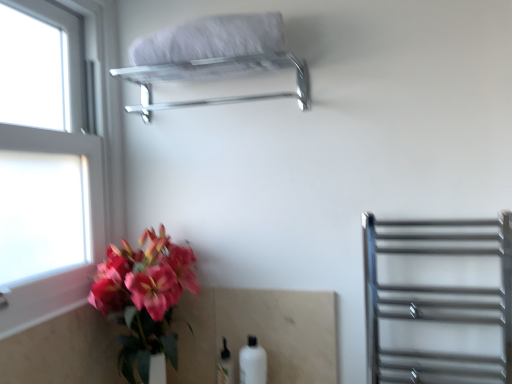
What are the coordinates of `polished chrome towel rack at right` in the screenshot? It's located at (438, 300).

The image size is (512, 384). What do you see at coordinates (438, 300) in the screenshot? I see `polished chrome towel rack at right` at bounding box center [438, 300].

The height and width of the screenshot is (384, 512). What are the coordinates of `white matte bottle at lower center, the second bottle from the left` in the screenshot? It's located at (252, 363).

Describe the element at coordinates (252, 363) in the screenshot. I see `white matte bottle at lower center, which appears as the 1th bottle when viewed from the right` at that location.

Find the location of a particular element. The image size is (512, 384). polished chrome towel rack at upper center is located at coordinates (212, 58).

Where is `white matte bottle at lower center, the 2th bottle positioned from the right`? The image size is (512, 384). white matte bottle at lower center, the 2th bottle positioned from the right is located at coordinates (225, 366).

Between polished chrome towel rack at right and polished chrome towel rack at upper center, which one has smaller width?

polished chrome towel rack at upper center.

Considering their positions, is polished chrome towel rack at right located in front of or behind polished chrome towel rack at upper center?

Visually, polished chrome towel rack at right is located in front of polished chrome towel rack at upper center.

Is polished chrome towel rack at right positioned far away from polished chrome towel rack at upper center?

No, polished chrome towel rack at right is not far from polished chrome towel rack at upper center.

Is white glass window at left located within white fluffy towel at upper center?

No.

From the picture: Can you confirm if white fluffy towel at upper center is smaller than white glass window at left?

Correct, white fluffy towel at upper center occupies less space than white glass window at left.

What's the angular difference between white fluffy towel at upper center and white glass window at left's facing directions?

90.1 degrees separate the facing orientations of white fluffy towel at upper center and white glass window at left.

Is white fluffy towel at upper center next to white glass window at left and touching it?

There is a gap between white fluffy towel at upper center and white glass window at left.

Is white matte bottle at lower center, which ranks as the first bottle in left-to-right order, wider than white fluffy towel at upper center?

No.

From the image's perspective, relative to white fluffy towel at upper center, is white matte bottle at lower center, the 2th bottle positioned from the right, above or below?

white matte bottle at lower center, the 2th bottle positioned from the right, is situated lower than white fluffy towel at upper center in the image.

Is white matte bottle at lower center, which ranks as the first bottle in left-to-right order, surrounding white fluffy towel at upper center?

No, white fluffy towel at upper center is located outside of white matte bottle at lower center, which ranks as the first bottle in left-to-right order.

Are white matte bottle at lower center, the 2th bottle positioned from the right, and white fluffy towel at upper center making contact?

No, white matte bottle at lower center, the 2th bottle positioned from the right, is not next to white fluffy towel at upper center.

Between white glass window at left and polished chrome towel rack at upper center, which one has smaller size?

Smaller between the two is polished chrome towel rack at upper center.

Which is more to the left, white glass window at left or polished chrome towel rack at upper center?

white glass window at left is more to the left.

Is white glass window at left turned away from polished chrome towel rack at upper center?

No, white glass window at left's orientation is not away from polished chrome towel rack at upper center.

The height and width of the screenshot is (384, 512). What are the coordinates of `window that appears in front of the polished chrome towel rack at upper center` in the screenshot? It's located at (46, 172).

From a real-world perspective, is polished chrome towel rack at right above or below white matte bottle at lower center, which appears as the 1th bottle when viewed from the right?

polished chrome towel rack at right is situated higher than white matte bottle at lower center, which appears as the 1th bottle when viewed from the right, in the real world.

Looking at this image, is polished chrome towel rack at right aimed at white matte bottle at lower center, the second bottle from the left?

No.

Which is closer, (495, 289) or (262, 360)?

Point (495, 289) appears to be closer to the viewer than point (262, 360).

From the image's perspective, between polished chrome towel rack at right and white matte bottle at lower center, which appears as the 1th bottle when viewed from the right, which one is located above?

polished chrome towel rack at right.

Can we say white fluffy towel at upper center lies outside white matte bottle at lower center, which appears as the 1th bottle when viewed from the right?

Absolutely, white fluffy towel at upper center is external to white matte bottle at lower center, which appears as the 1th bottle when viewed from the right.

Based on the photo, is white fluffy towel at upper center looking in the opposite direction of white matte bottle at lower center, the second bottle from the left?

No.

How different are the orientations of white fluffy towel at upper center and white matte bottle at lower center, which appears as the 1th bottle when viewed from the right, in degrees?

The angle between the facing direction of white fluffy towel at upper center and the facing direction of white matte bottle at lower center, which appears as the 1th bottle when viewed from the right, is 1.45 degrees.

From a real-world perspective, between white matte bottle at lower center, the 2th bottle positioned from the right, and white matte bottle at lower center, the second bottle from the left, who is vertically lower?

white matte bottle at lower center, the 2th bottle positioned from the right, is physically lower.

Between white matte bottle at lower center, which ranks as the first bottle in left-to-right order, and white matte bottle at lower center, the second bottle from the left, which one has more height?

white matte bottle at lower center, the second bottle from the left, is taller.

Is white matte bottle at lower center, which ranks as the first bottle in left-to-right order, positioned with its back to white matte bottle at lower center, the second bottle from the left?

white matte bottle at lower center, which ranks as the first bottle in left-to-right order, is not turned away from white matte bottle at lower center, the second bottle from the left.

Based on their sizes in the image, would you say white matte bottle at lower center, which ranks as the first bottle in left-to-right order, is bigger or smaller than white matte bottle at lower center, the second bottle from the left?

In the image, white matte bottle at lower center, which ranks as the first bottle in left-to-right order, appears to be smaller than white matte bottle at lower center, the second bottle from the left.

What are the coordinates of `bunk bed that is above the polished chrome towel rack at right (from a real-world perspective)` in the screenshot? It's located at (212, 58).

This screenshot has height=384, width=512. What are the coordinates of `window below the white fluffy towel at upper center (from the image's perspective)` in the screenshot? It's located at (46, 172).

Based on their spatial positions, is white glass window at left or white fluffy towel at upper center closer to white matte bottle at lower center, the 2th bottle positioned from the right?

white glass window at left lies closer to white matte bottle at lower center, the 2th bottle positioned from the right, than the other object.

Looking at the image, which one is located closer to polished chrome towel rack at upper center, white glass window at left or white fluffy towel at upper center?

Among the two, white fluffy towel at upper center is located nearer to polished chrome towel rack at upper center.

When comparing their distances from white fluffy towel at upper center, does polished chrome towel rack at right or white matte bottle at lower center, the second bottle from the left, seem closer?

polished chrome towel rack at right is closer to white fluffy towel at upper center.

When comparing their distances from white matte bottle at lower center, the second bottle from the left, does white glass window at left or white matte bottle at lower center, which ranks as the first bottle in left-to-right order, seem closer?

The object closer to white matte bottle at lower center, the second bottle from the left, is white matte bottle at lower center, which ranks as the first bottle in left-to-right order.

Looking at the image, which one is located closer to polished chrome towel rack at upper center, white fluffy towel at upper center or white matte bottle at lower center, the 2th bottle positioned from the right?

white fluffy towel at upper center is closer to polished chrome towel rack at upper center.

Looking at the image, which one is located further to white fluffy towel at upper center, white glass window at left or polished chrome towel rack at upper center?

white glass window at left.

Considering their positions, is polished chrome towel rack at upper center positioned closer to white glass window at left than white fluffy towel at upper center?

polished chrome towel rack at upper center is positioned closer to the anchor white glass window at left.

Based on the photo, based on their spatial positions, is white matte bottle at lower center, the second bottle from the left, or white fluffy towel at upper center further from white matte bottle at lower center, which ranks as the first bottle in left-to-right order?

white fluffy towel at upper center.

Find the location of `bottle between white glass window at left and white matte bottle at lower center, which ranks as the first bottle in left-to-right order, from top to bottom`. bottle between white glass window at left and white matte bottle at lower center, which ranks as the first bottle in left-to-right order, from top to bottom is located at coordinates tap(252, 363).

Locate an element on the screen. Image resolution: width=512 pixels, height=384 pixels. shelf between polished chrome towel rack at upper center and white matte bottle at lower center, the 2th bottle positioned from the right, in the up-down direction is located at coordinates (438, 300).

Find the location of a particular element. The height and width of the screenshot is (384, 512). shelf between white fluffy towel at upper center and white matte bottle at lower center, which ranks as the first bottle in left-to-right order, in the vertical direction is located at coordinates (438, 300).

At what (x,y) coordinates should I click in order to perform the action: click on bottle situated between white matte bottle at lower center, the 2th bottle positioned from the right, and polished chrome towel rack at right from left to right. Please return your answer as a coordinate pair (x, y). Image resolution: width=512 pixels, height=384 pixels. Looking at the image, I should click on (252, 363).